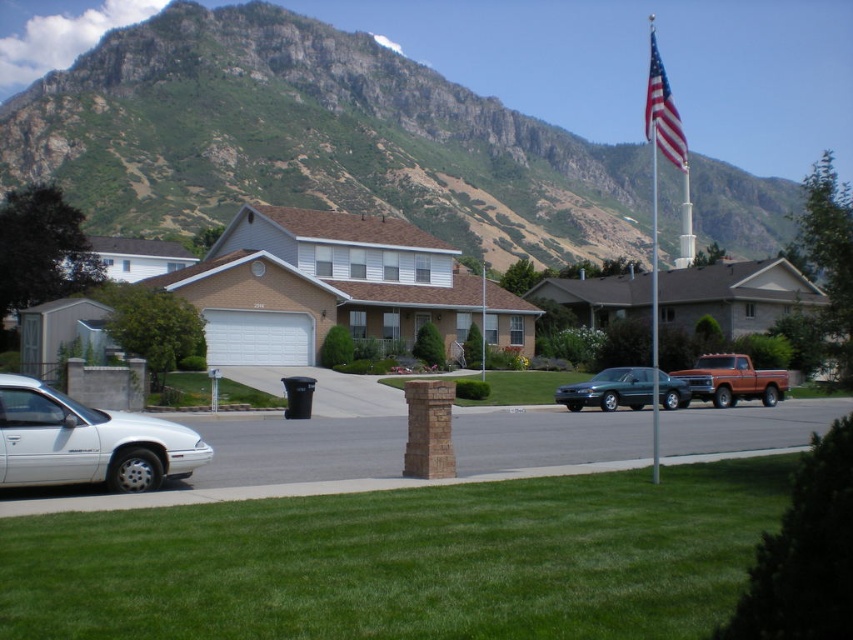
Question: Among these objects, which one is farthest from the camera?

Choices:
 (A) green matte sedan at center
 (B) green grass at lower center
 (C) green rocky mountain at upper center

Answer: (C)

Question: Does white glossy sedan at lower left have a greater width compared to green matte sedan at center?

Choices:
 (A) no
 (B) yes

Answer: (B)

Question: Does white glossy sedan at lower left have a greater width compared to metallic flag pole at center?

Choices:
 (A) no
 (B) yes

Answer: (A)

Question: Is green grass at lower center further to the viewer compared to metallic flagpole at center?

Choices:
 (A) yes
 (B) no

Answer: (B)

Question: Which of the following is the closest to the observer?

Choices:
 (A) white glossy sedan at lower left
 (B) green grass at lower center
 (C) metallic flag pole at center
 (D) metallic flagpole at center

Answer: (B)

Question: Which point is closer to the camera taking this photo?

Choices:
 (A) (105, 416)
 (B) (651, 20)

Answer: (A)